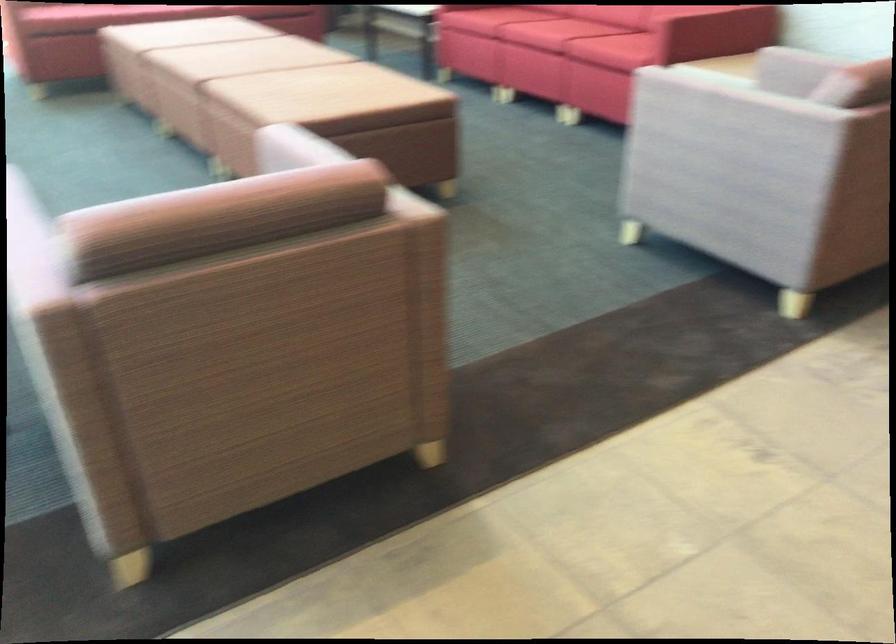
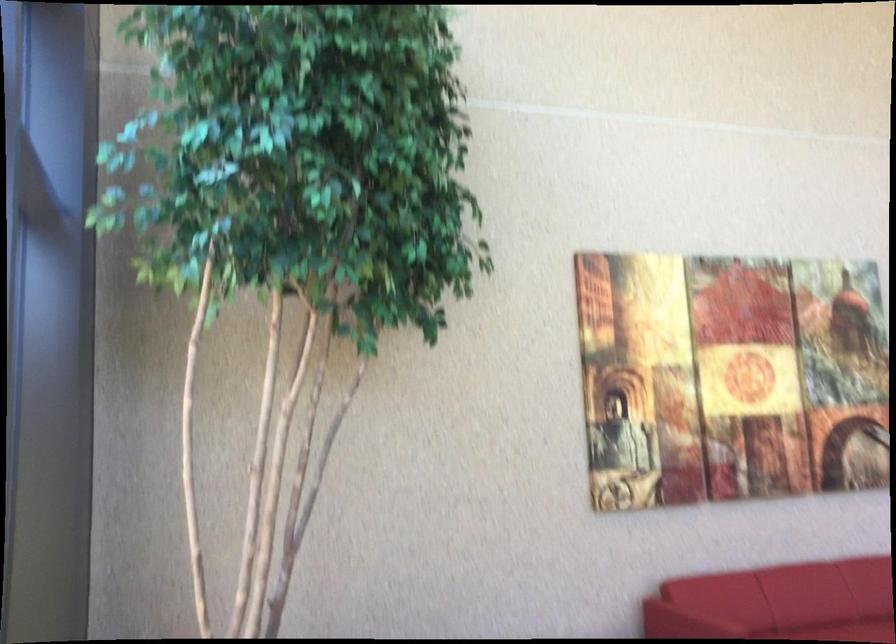
The first image is from the beginning of the video and the second image is from the end. How did the camera likely rotate when shooting the video?

The camera's rotation is toward right-down.